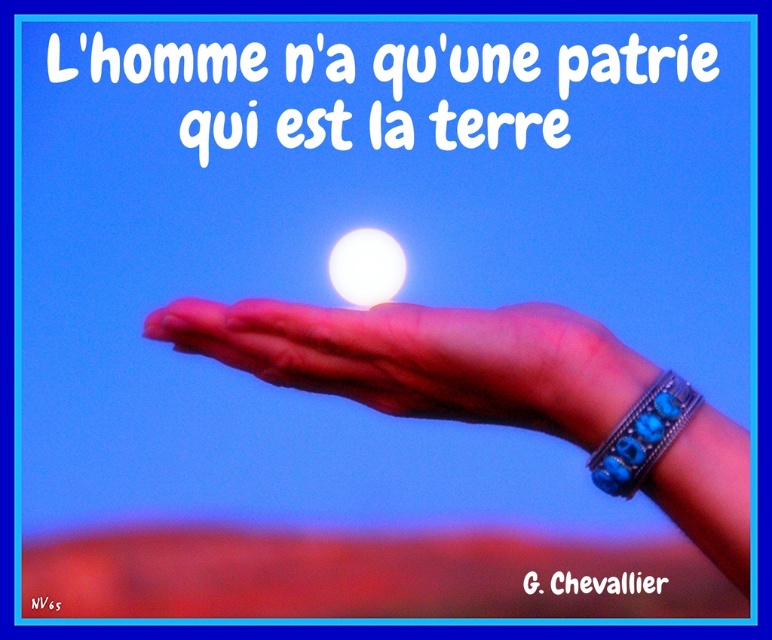
Can you confirm if pink leather hand at center is smaller than white glossy sphere at center?

No, pink leather hand at center is not smaller than white glossy sphere at center.

Which is more to the right, pink leather hand at center or white glossy sphere at center?

pink leather hand at center is more to the right.

Find the location of `pink leather hand at center`. pink leather hand at center is located at coordinates (425, 358).

Can you confirm if blue stone bracelet at lower right is taller than white glossy sphere at center?

No.

Locate an element on the screen. This screenshot has width=772, height=640. blue stone bracelet at lower right is located at coordinates (642, 435).

Identify the location of blue stone bracelet at lower right. (642, 435).

Is point (340, 332) more distant than point (280, 356)?

No, (340, 332) is closer to viewer.

Which is more to the left, pink leather bracelet at center or pink leather hand at center?

pink leather hand at center

Find the location of a particular element. The image size is (772, 640). pink leather bracelet at center is located at coordinates [x=503, y=392].

Locate an element on the screen. This screenshot has width=772, height=640. pink leather bracelet at center is located at coordinates coord(503,392).